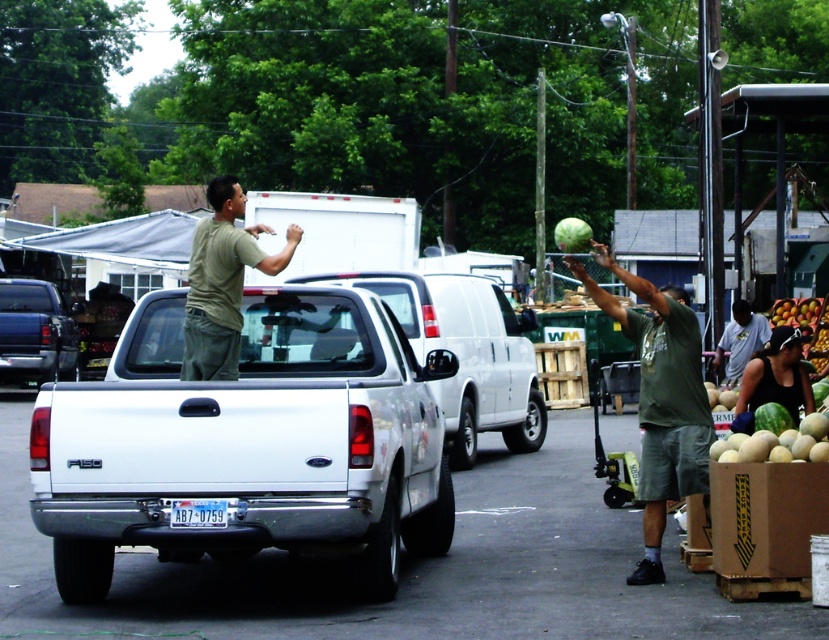
You are a delivery driver who needs to park your vehicle in this market area. You see the white matte truck at center and the gray cotton shirt at right. Which object is closer to the left side of the image?

The white matte truck at center is positioned on the left side of gray cotton shirt at right, so the white matte truck at center is closer to the left side of the image.